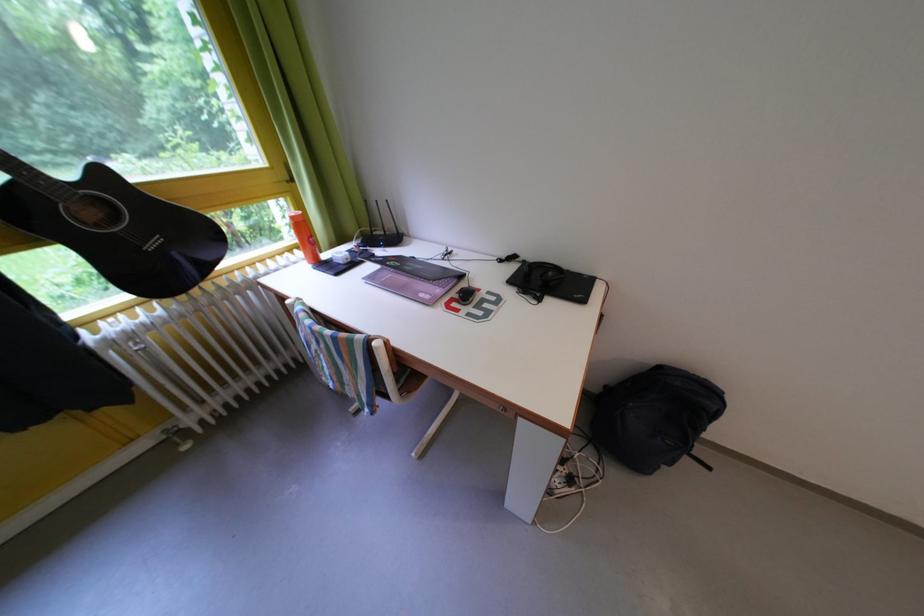
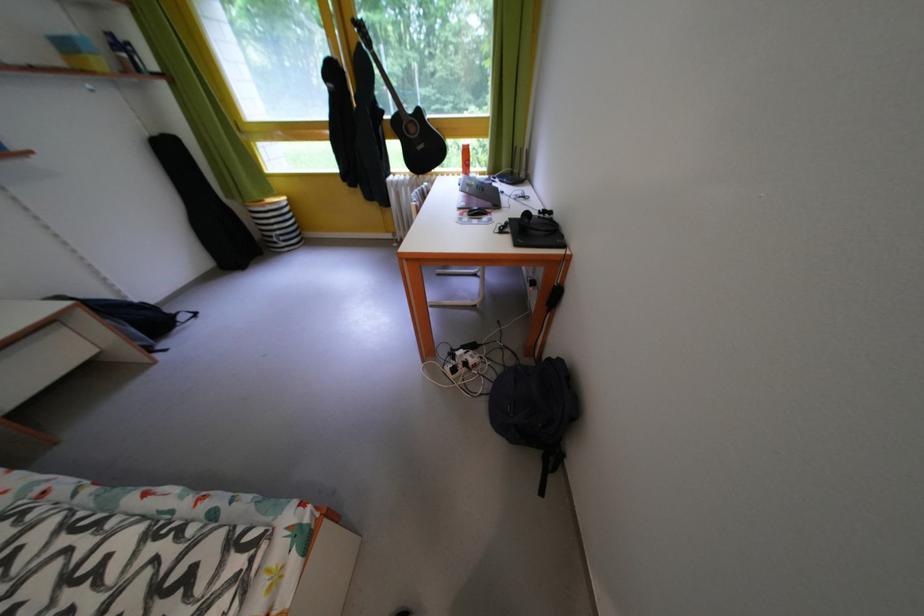
Where in the second image is the point corresponding to (x=511, y=267) from the first image?

(550, 217)